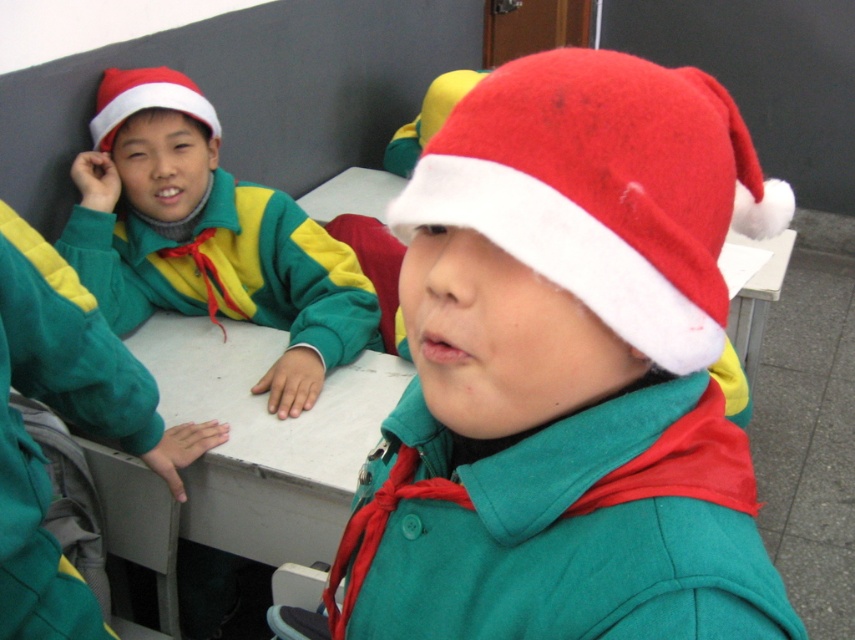
Can you confirm if white matte table at center is bigger than matte red santa hat at upper left?

Yes, white matte table at center is bigger than matte red santa hat at upper left.

Is white matte table at center positioned at the back of matte red santa hat at upper left?

That is False.

Is point (220, 518) positioned after point (133, 86)?

No, it is in front of (133, 86).

Find the location of a particular element. The image size is (855, 640). white matte table at center is located at coordinates (264, 436).

Does felt santa hat at center appear over red felt santa hat at center?

No.

Can you confirm if felt santa hat at center is shorter than red felt santa hat at center?

No.

Is point (506, 401) positioned in front of point (494, 225)?

No, it is behind (494, 225).

This screenshot has width=855, height=640. Identify the location of felt santa hat at center. (567, 371).

Between point (724, 204) and point (348, 486), which one is positioned behind?

Point (348, 486)

Is red felt santa hat at center closer to camera compared to white matte table at center?

Yes, it is.

Identify the location of red felt santa hat at center. (604, 189).